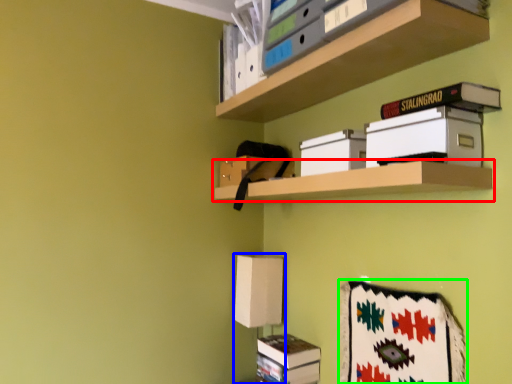
Question: Which object is the farthest from shelf (highlighted by a red box)? Choose among these: table lamp (highlighted by a blue box) or blanket (highlighted by a green box).

Choices:
 (A) table lamp
 (B) blanket

Answer: (A)